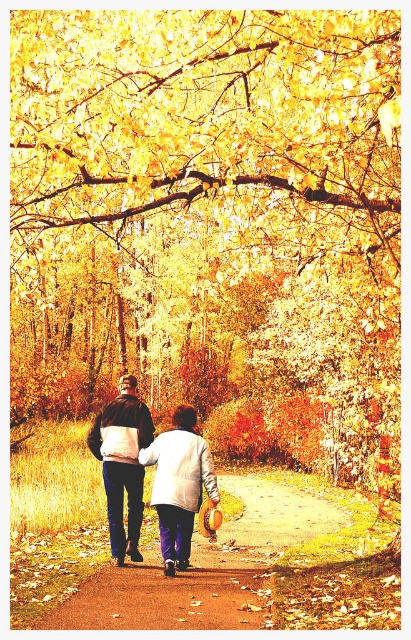
Question: Does brown dirt path at center appear on the left side of white cotton jacket at center?

Choices:
 (A) no
 (B) yes

Answer: (A)

Question: Can you confirm if white cotton jacket at center is smaller than dark brown leather jacket at center?

Choices:
 (A) no
 (B) yes

Answer: (A)

Question: Among these points, which one is farthest from the camera?

Choices:
 (A) (129, 470)
 (B) (140, 420)

Answer: (B)

Question: Which object is the closest to the dark brown leather jacket at center?

Choices:
 (A) white cotton jacket at center
 (B) brown dirt path at center

Answer: (A)

Question: Which of the following is the closest to the observer?

Choices:
 (A) white cotton jacket at center
 (B) dark brown leather jacket at center
 (C) brown dirt path at center

Answer: (C)

Question: Is brown dirt path at center thinner than dark brown leather jacket at center?

Choices:
 (A) yes
 (B) no

Answer: (B)